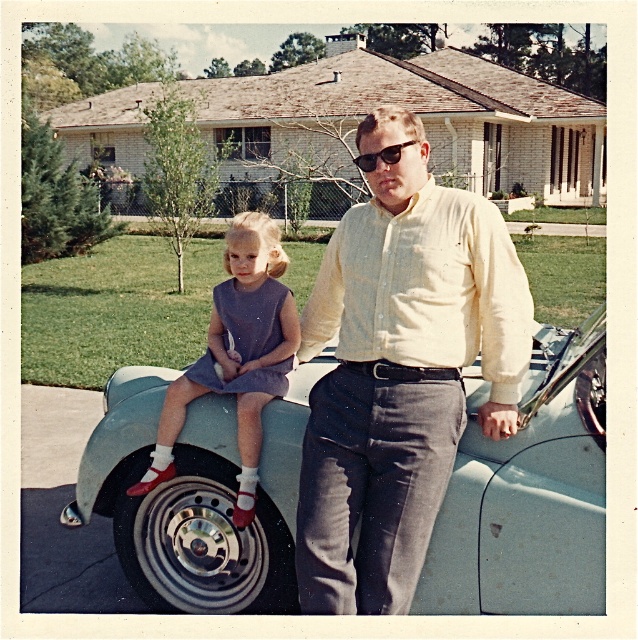
You are a photographer who needs to frame a shot that includes both the metallic silver rim at lower left and the matte purple dress at center. Which object should you adjust your camera angle to prioritize if you want to ensure both are fully visible without cropping?

Since the metallic silver rim at lower left is bigger than the matte purple dress at center, you should prioritize adjusting your camera angle to accommodate the larger metallic silver rim at lower left to ensure both objects are fully visible without cropping.

You are a photographer setting up for a portrait. You need to position two subjects so that they are exactly 24 inches apart. Given the current distance between the metallic silver rim at lower left and the matte purple dress at center, can you determine if they are positioned correctly?

The metallic silver rim at lower left is currently 22.02 inches away from the matte purple dress at center, which is less than the required 24 inches. Therefore, they are not positioned correctly and need to be moved further apart by approximately 1.98 inches.